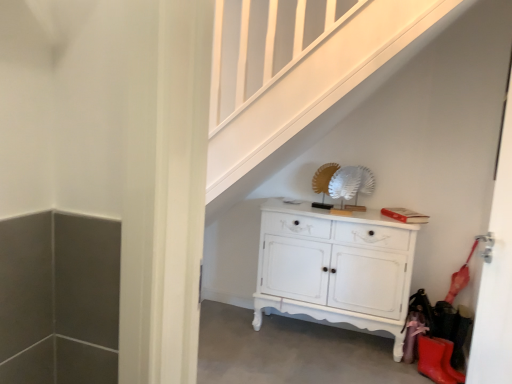
Question: Is white painted wood cabinet at center bigger or smaller than white glossy door at right?

Choices:
 (A) big
 (B) small

Answer: (A)

Question: From a real-world perspective, is white painted wood cabinet at center physically located above or below white glossy door at right?

Choices:
 (A) below
 (B) above

Answer: (A)

Question: Which is nearer to the rubber matte boot at lower right?

Choices:
 (A) white painted wood cabinet at center
 (B) white glossy door at right

Answer: (A)

Question: Which of these objects is positioned closest to the rubber matte boot at lower right?

Choices:
 (A) white painted wood cabinet at center
 (B) white glossy door at right

Answer: (A)